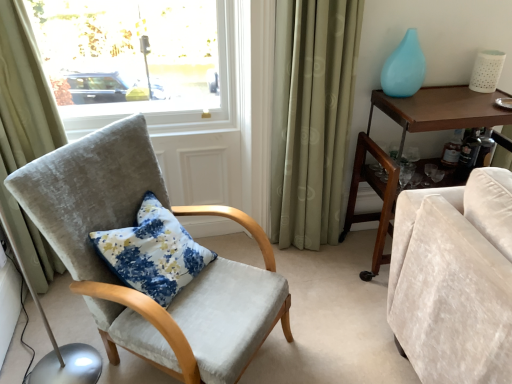
Question: Which direction should I rotate to face green fabric curtain at center, which is counted as the second curtain, starting from the left, — up or down?

Choices:
 (A) down
 (B) up

Answer: (B)

Question: Is beige fabric curtain at left, arranged as the 2th curtain when viewed from the right, looking in the opposite direction of floral fabric cushion at center?

Choices:
 (A) no
 (B) yes

Answer: (A)

Question: Is beige fabric curtain at left, which is the first curtain from left to right, smaller than floral fabric cushion at center?

Choices:
 (A) no
 (B) yes

Answer: (A)

Question: Is beige fabric curtain at left, which is the first curtain from left to right, oriented towards floral fabric cushion at center?

Choices:
 (A) yes
 (B) no

Answer: (B)

Question: Is beige fabric curtain at left, which is the first curtain from left to right, in contact with floral fabric cushion at center?

Choices:
 (A) yes
 (B) no

Answer: (B)

Question: Does beige fabric curtain at left, which is the first curtain from left to right, have a greater width compared to floral fabric cushion at center?

Choices:
 (A) yes
 (B) no

Answer: (B)

Question: Does beige fabric curtain at left, arranged as the 2th curtain when viewed from the right, appear on the right side of floral fabric cushion at center?

Choices:
 (A) no
 (B) yes

Answer: (A)

Question: Is green fabric curtain at center, arranged as the first curtain when viewed from the right, at the right side of beige fabric curtain at left, which is the first curtain from left to right?

Choices:
 (A) yes
 (B) no

Answer: (A)

Question: From the image's perspective, is green fabric curtain at center, which is counted as the second curtain, starting from the left, located beneath beige fabric curtain at left, arranged as the 2th curtain when viewed from the right?

Choices:
 (A) yes
 (B) no

Answer: (B)

Question: Does green fabric curtain at center, which is counted as the second curtain, starting from the left, have a larger size compared to beige fabric curtain at left, which is the first curtain from left to right?

Choices:
 (A) no
 (B) yes

Answer: (A)

Question: Does green fabric curtain at center, which is counted as the second curtain, starting from the left, have a lesser height compared to beige fabric curtain at left, arranged as the 2th curtain when viewed from the right?

Choices:
 (A) no
 (B) yes

Answer: (B)

Question: Is green fabric curtain at center, which is counted as the second curtain, starting from the left, next to beige fabric curtain at left, which is the first curtain from left to right?

Choices:
 (A) no
 (B) yes

Answer: (A)

Question: Is green fabric curtain at center, arranged as the first curtain when viewed from the right, not near beige fabric curtain at left, which is the first curtain from left to right?

Choices:
 (A) yes
 (B) no

Answer: (A)

Question: From the image's perspective, would you say beige fabric curtain at left, arranged as the 2th curtain when viewed from the right, is positioned over brown wood desk at right?

Choices:
 (A) no
 (B) yes

Answer: (B)